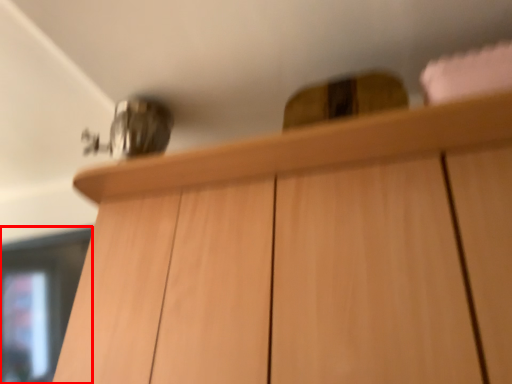
Question: In this image, where is glass door (annotated by the red box) located relative to cabinetry?

Choices:
 (A) left
 (B) right

Answer: (A)